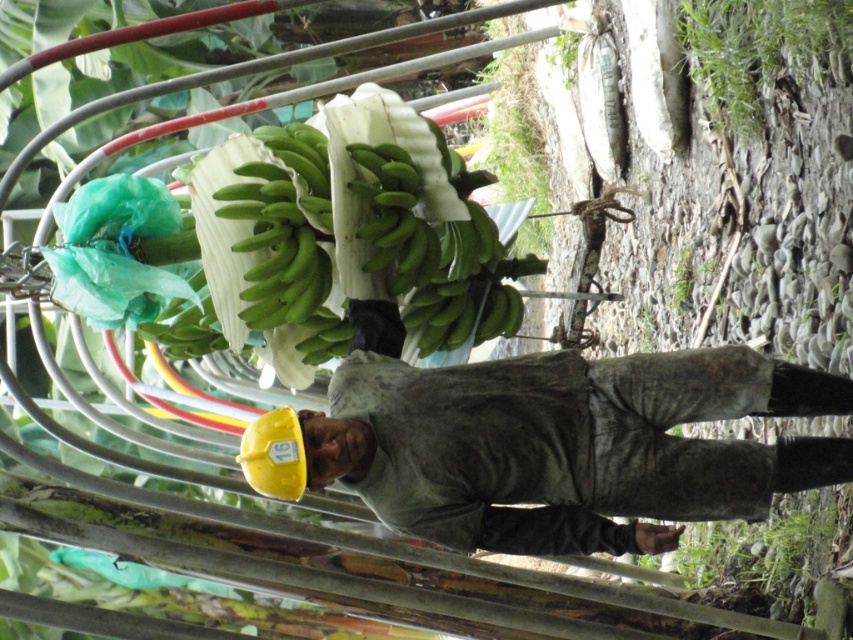
In the scene shown: You are a safety inspector observing the man in the scene. The yellow hard hat at center and the green matte bananas at center are both at the center of your view. Which object is bigger in size?

The yellow hard hat at center is larger in size compared to the green matte bananas at center according to the description.

You are a photographer trying to capture the man carrying bananas. You notice two points in the image at coordinates point (753,458) and point (253,186). Which point is closer to your camera lens?

Point (753,458) is closer to the camera than point (253,186).